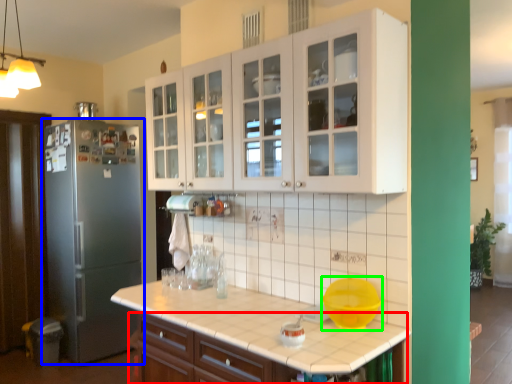
Question: Which object is positioned closest to cabinetry (highlighted by a red box)? Select from refrigerator (highlighted by a blue box) and mixing bowl (highlighted by a green box).

Choices:
 (A) refrigerator
 (B) mixing bowl

Answer: (B)